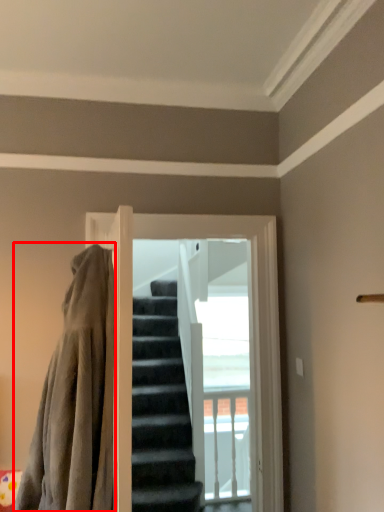
Question: Considering the relative positions of blanket (annotated by the red box) and screen door in the image provided, where is blanket (annotated by the red box) located with respect to the staircase?

Choices:
 (A) right
 (B) left

Answer: (B)